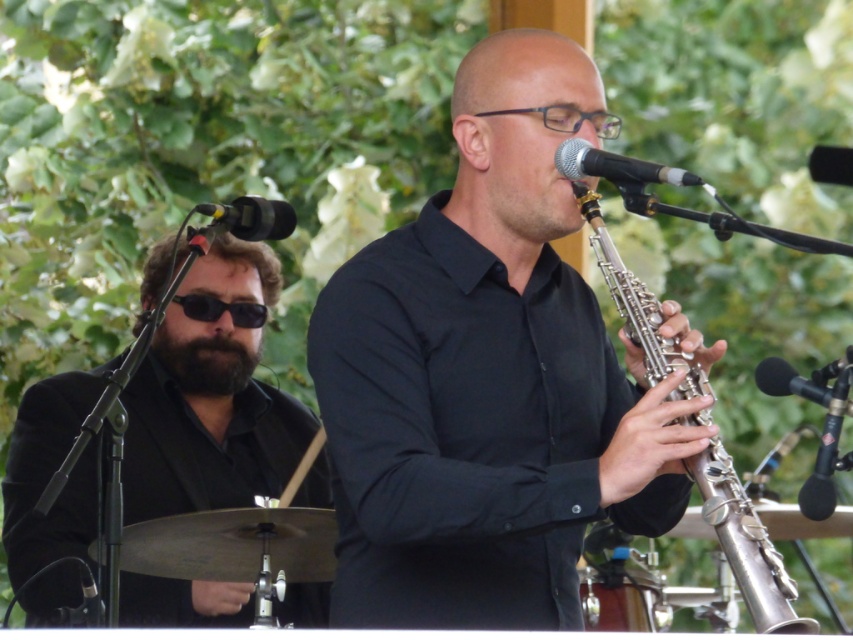
Who is shorter, metallic silver flute at center or black fuzzy beard at left?

black fuzzy beard at left

Is metallic silver flute at center taller than black fuzzy beard at left?

Yes.

Who is more distant from viewer, (498, 172) or (222, 369)?

Point (222, 369)

The height and width of the screenshot is (640, 853). I want to click on metallic silver flute at center, so click(x=486, y=376).

Does silver metallic oboe at center have a greater height compared to black fuzzy beard at left?

Yes, silver metallic oboe at center is taller than black fuzzy beard at left.

Between point (784, 588) and point (213, 358), which one is positioned behind?

The point (213, 358) is behind.

Based on the photo, who is more forward, [659,317] or [228,353]?

Point [659,317] is more forward.

Identify the location of silver metallic oboe at center. (746, 545).

Who is positioned more to the right, black matte sunglasses at left or black fuzzy beard at left?

black matte sunglasses at left is more to the right.

Image resolution: width=853 pixels, height=640 pixels. What do you see at coordinates (212, 396) in the screenshot? I see `black matte sunglasses at left` at bounding box center [212, 396].

Find the location of `black matte sunglasses at left`. black matte sunglasses at left is located at coordinates (212, 396).